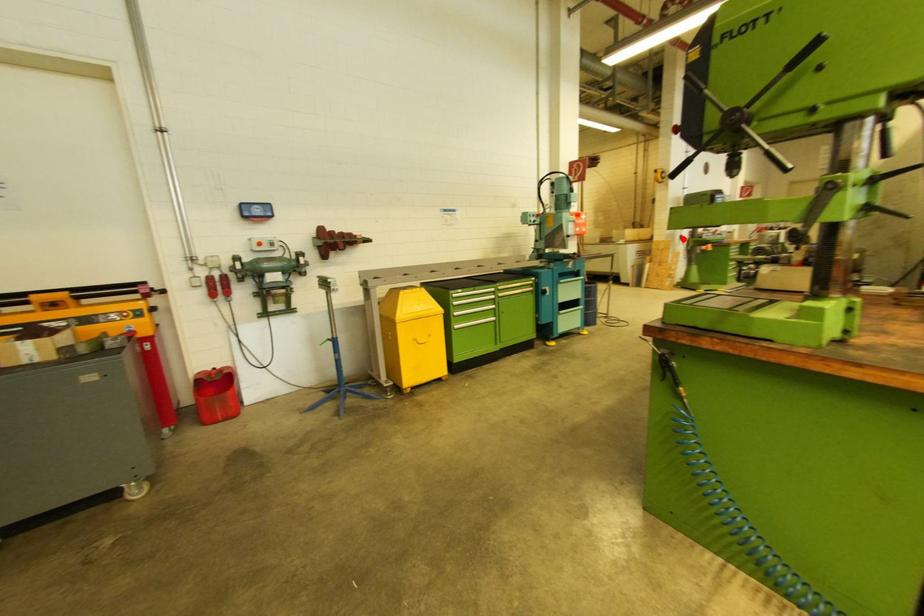
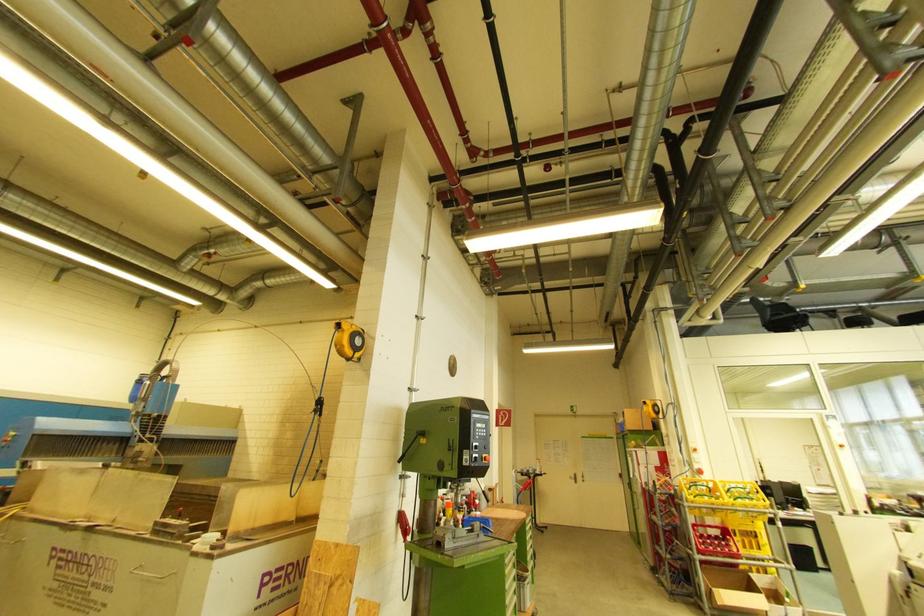
Where in the second image is the point corresponding to the highlighted location from the first image?

(404, 519)